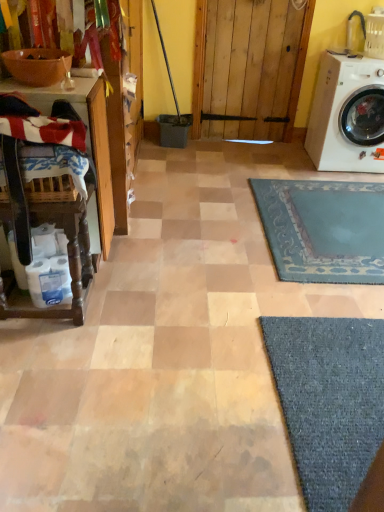
Question: From the image's perspective, would you say wooden table at left, the second table from the bottom, is shown under matte brown bowl at upper left?

Choices:
 (A) yes
 (B) no

Answer: (A)

Question: Is wooden table at left, the first table viewed from the top, further to camera compared to matte brown bowl at upper left?

Choices:
 (A) yes
 (B) no

Answer: (A)

Question: Is wooden table at left, the second table from the bottom, positioned with its back to matte brown bowl at upper left?

Choices:
 (A) no
 (B) yes

Answer: (A)

Question: From a real-world perspective, is wooden table at left, the first table viewed from the top, positioned over matte brown bowl at upper left based on gravity?

Choices:
 (A) yes
 (B) no

Answer: (B)

Question: Is wooden table at left, the first table viewed from the top, bigger than matte brown bowl at upper left?

Choices:
 (A) no
 (B) yes

Answer: (B)

Question: Is matte brown bowl at upper left completely or partially inside wooden table at left, the first table viewed from the top?

Choices:
 (A) yes
 (B) no

Answer: (B)

Question: From a real-world perspective, is striped cotton laundry at left on wooden table at left, the second table from the bottom?

Choices:
 (A) no
 (B) yes

Answer: (B)

Question: Can you confirm if striped cotton laundry at left is smaller than wooden table at left, the first table viewed from the top?

Choices:
 (A) yes
 (B) no

Answer: (A)

Question: Is striped cotton laundry at left not inside wooden table at left, the first table viewed from the top?

Choices:
 (A) yes
 (B) no

Answer: (A)

Question: From the image's perspective, is striped cotton laundry at left located above wooden table at left, the first table viewed from the top?

Choices:
 (A) yes
 (B) no

Answer: (A)

Question: Is striped cotton laundry at left beside wooden table at left, the second table from the bottom?

Choices:
 (A) yes
 (B) no

Answer: (B)

Question: Considering the relative sizes of striped cotton laundry at left and wooden table at left, the second table from the bottom, in the image provided, is striped cotton laundry at left wider than wooden table at left, the second table from the bottom,?

Choices:
 (A) no
 (B) yes

Answer: (A)

Question: Is striped cotton laundry at left turned away from wooden table at left, the 1th table in the bottom-to-top sequence?

Choices:
 (A) no
 (B) yes

Answer: (A)